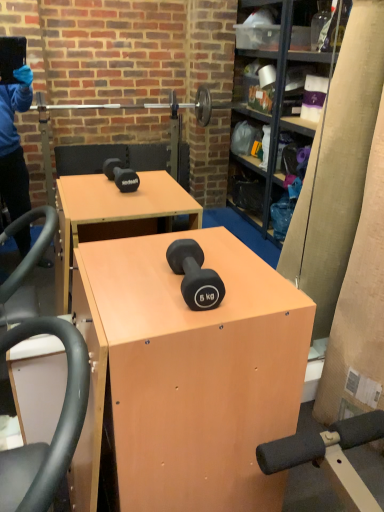
The image size is (384, 512). Find the location of `free space to the back side of matte black dumbbell at center`. free space to the back side of matte black dumbbell at center is located at coordinates (201, 253).